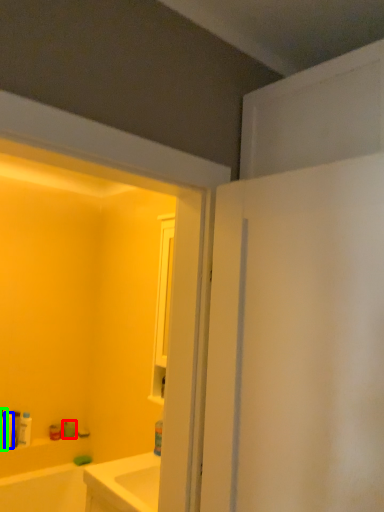
Question: Based on their relative distances, which object is nearer to toiletry (highlighted by a red box)? Choose from toiletry (highlighted by a blue box) and toiletry (highlighted by a green box).

Choices:
 (A) toiletry
 (B) toiletry

Answer: (A)